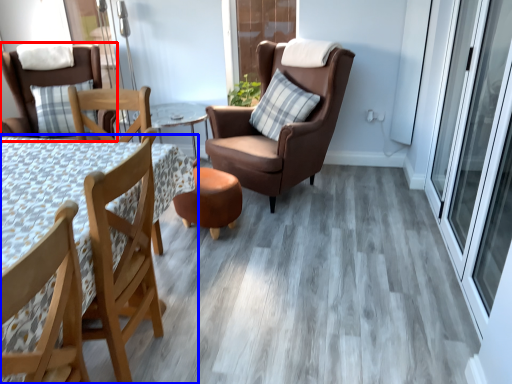
Question: Which object appears farthest to the camera in this image, chair (highlighted by a red box) or table (highlighted by a blue box)?

Choices:
 (A) chair
 (B) table

Answer: (A)